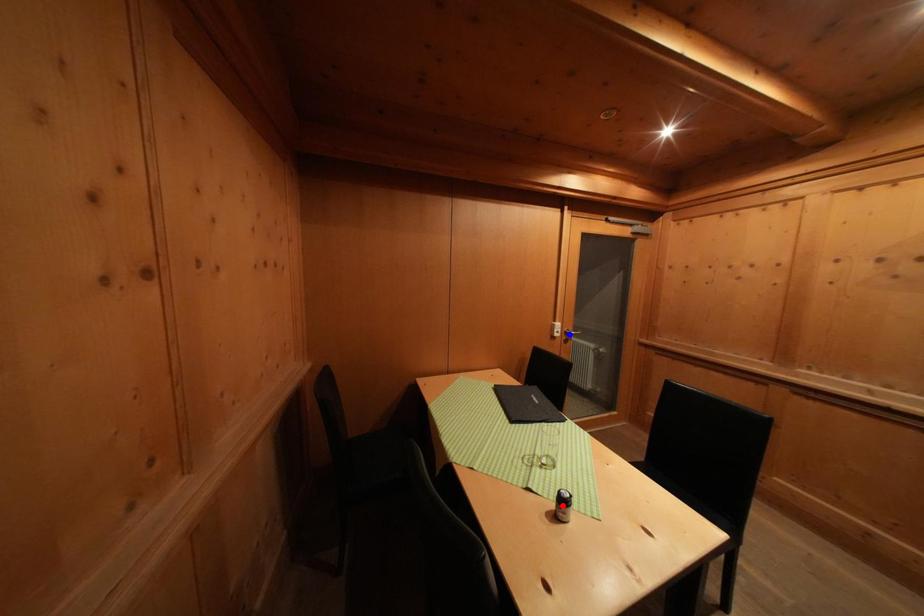
Question: In the image, two points are highlighted. Which point is nearer to the camera? Reply with the corresponding letter.

Choices:
 (A) blue point
 (B) red point

Answer: (B)